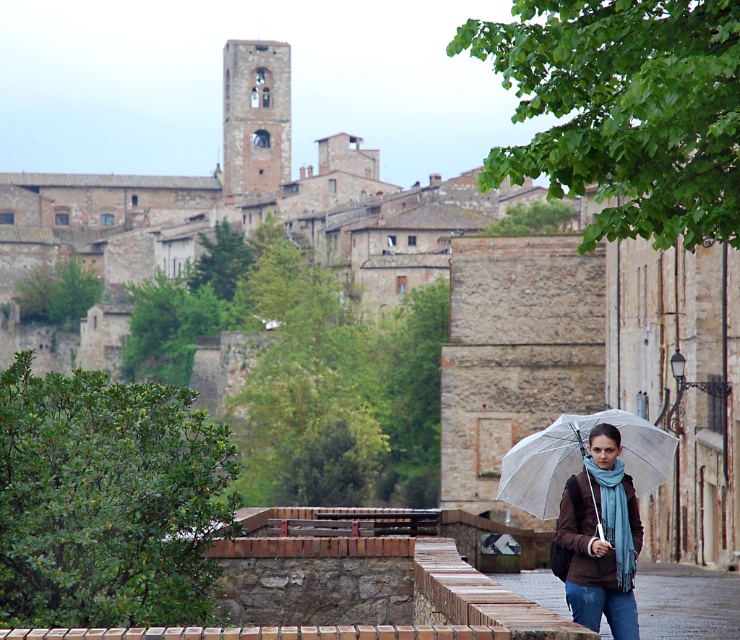
You are standing in the historic town and want to find the person with the transparent umbrella. Which direction should you look to find the point marked at coordinates (x=599, y=538) on the brown matte jacket at lower right?

The point marked at coordinates (x=599, y=538) is located on the brown matte jacket at lower right, so you should look to your lower right direction to find the person with the transparent umbrella.

Looking at this image, you are a tourist in the historic town and want to take a photo of the transparent plastic umbrella at center and the smooth stone alley at lower center. Which object should you focus on first if you want to capture both in a single frame without moving the camera?

You should focus on the transparent plastic umbrella at center first because it is smaller than the smooth stone alley at lower center, allowing it to fit within the frame more easily while still including the alley.

You are a tourist in the historic town and want to take a photo of the smooth stone alley at lower center without any people blocking it. The person wearing the brown matte jacket at lower right is currently walking towards the alley. Based on their current position, will the jacket wearer block the alley in your photo?

The brown matte jacket at lower right is in front of the smooth stone alley at lower center, so the person wearing it will block the alley in your photo if they continue moving towards it.